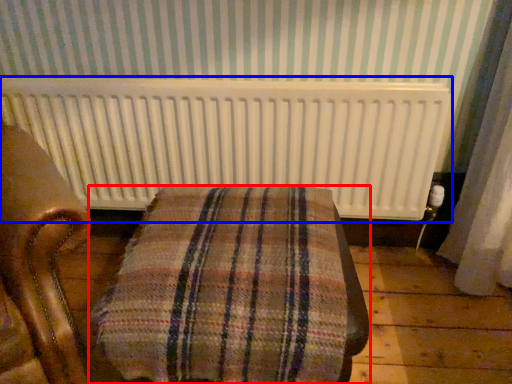
Question: Which object is closer to the camera taking this photo, furniture (highlighted by a red box) or radiator (highlighted by a blue box)?

Choices:
 (A) furniture
 (B) radiator

Answer: (A)